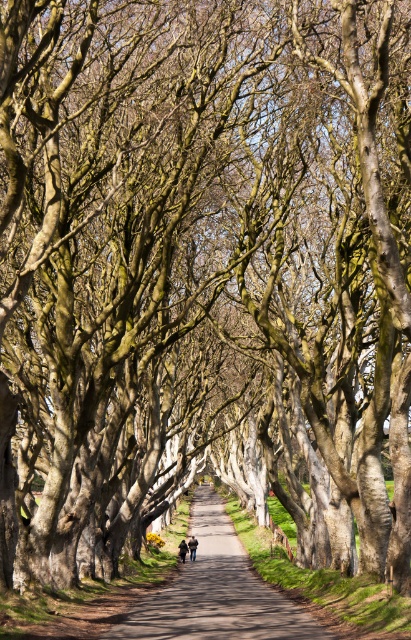
Question: Is brown leather jacket at center positioned before dark brown leather jacket at center?

Choices:
 (A) yes
 (B) no

Answer: (B)

Question: Can you confirm if smooth asphalt path at center is thinner than brown leather jacket at center?

Choices:
 (A) no
 (B) yes

Answer: (A)

Question: Which of the following is the closest to the observer?

Choices:
 (A) (193, 552)
 (B) (171, 596)
 (C) (184, 550)

Answer: (B)

Question: Can you confirm if smooth asphalt path at center is wider than dark brown leather jacket at center?

Choices:
 (A) yes
 (B) no

Answer: (A)

Question: Which of the following is the closest to the observer?

Choices:
 (A) (194, 561)
 (B) (191, 545)
 (C) (182, 550)

Answer: (C)

Question: Which point appears closest to the camera in this image?

Choices:
 (A) (184, 554)
 (B) (191, 545)

Answer: (A)